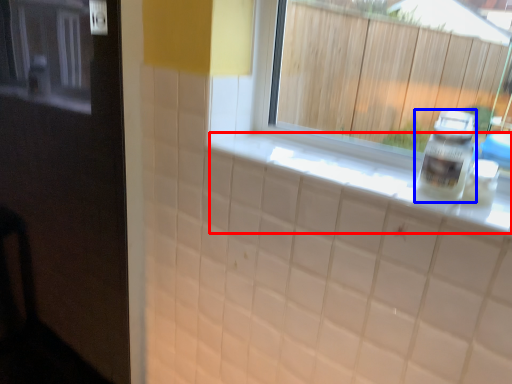
Question: Among these objects, which one is nearest to the camera, counter top (highlighted by a red box) or bottle (highlighted by a blue box)?

Choices:
 (A) counter top
 (B) bottle

Answer: (A)